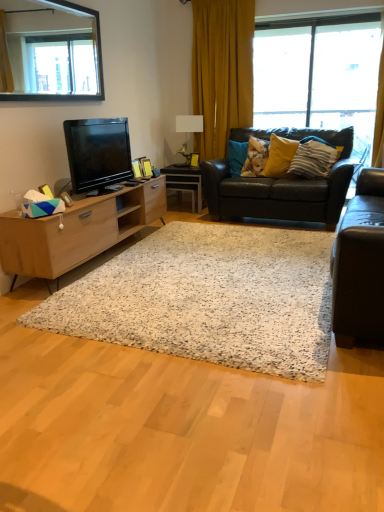
Question: Considering the positions of black glass mirror at upper left and yellow matte pillow at upper right, acting as the second pillow starting from the left, in the image, is black glass mirror at upper left wider or thinner than yellow matte pillow at upper right, acting as the second pillow starting from the left,?

Choices:
 (A) thin
 (B) wide

Answer: (A)

Question: Is point (6, 91) positioned closer to the camera than point (281, 138)?

Choices:
 (A) closer
 (B) farther

Answer: (A)

Question: Which of these objects is positioned farthest from the black glass mirror at upper left?

Choices:
 (A) black glossy television at left
 (B) leather couch at right, acting as the first studio couch starting from the front
 (C) yellow matte pillow at upper right, acting as the second pillow starting from the left
 (D) white glossy lamp at upper center
 (E) fluffy fabric pillow at center, placed as the third pillow when sorted from right to left

Answer: (B)

Question: Which of these objects is positioned farthest from the white glossy desk at center?

Choices:
 (A) yellow striped pillow at upper right, which is counted as the third pillow, starting from the left
 (B) black glass mirror at upper left
 (C) yellow matte pillow at upper right, acting as the second pillow starting from the left
 (D) leather couch at center, arranged as the second studio couch when viewed from the front
 (E) black glossy television at left

Answer: (B)